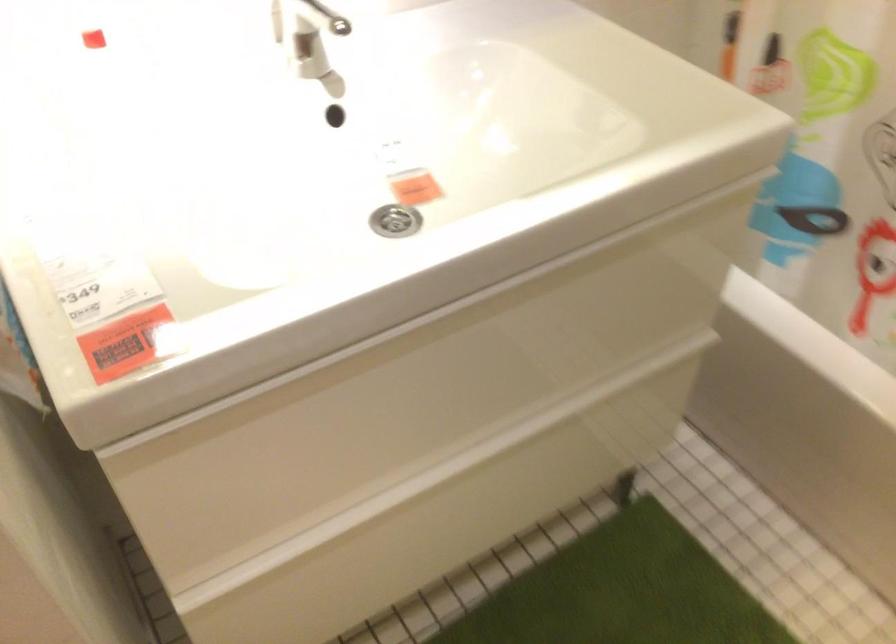
Find where to pull the top drawer front. Please return your answer as a coordinate pair (x, y).

(423, 392)